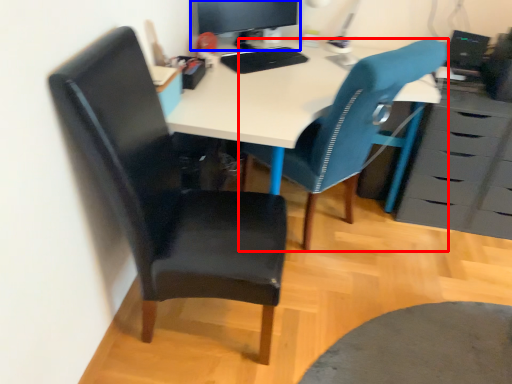
Question: Which of the following is the farthest to the observer, chair (highlighted by a red box) or computer monitor (highlighted by a blue box)?

Choices:
 (A) chair
 (B) computer monitor

Answer: (B)